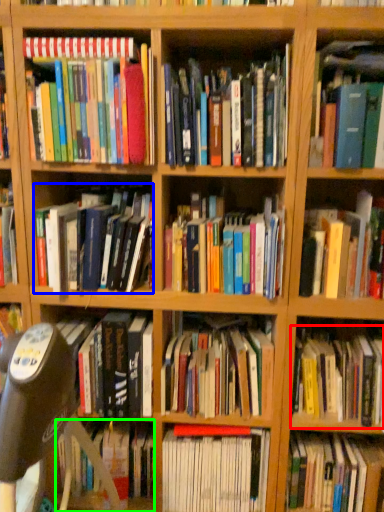
Question: Which object is the closest to the book (highlighted by a red box)? Choose among these: book (highlighted by a blue box) or book (highlighted by a green box).

Choices:
 (A) book
 (B) book

Answer: (A)